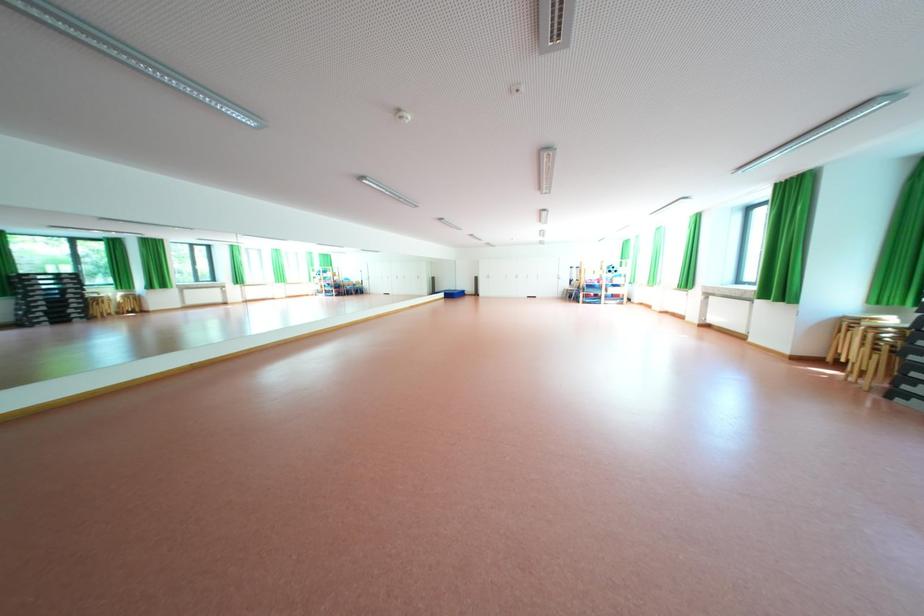
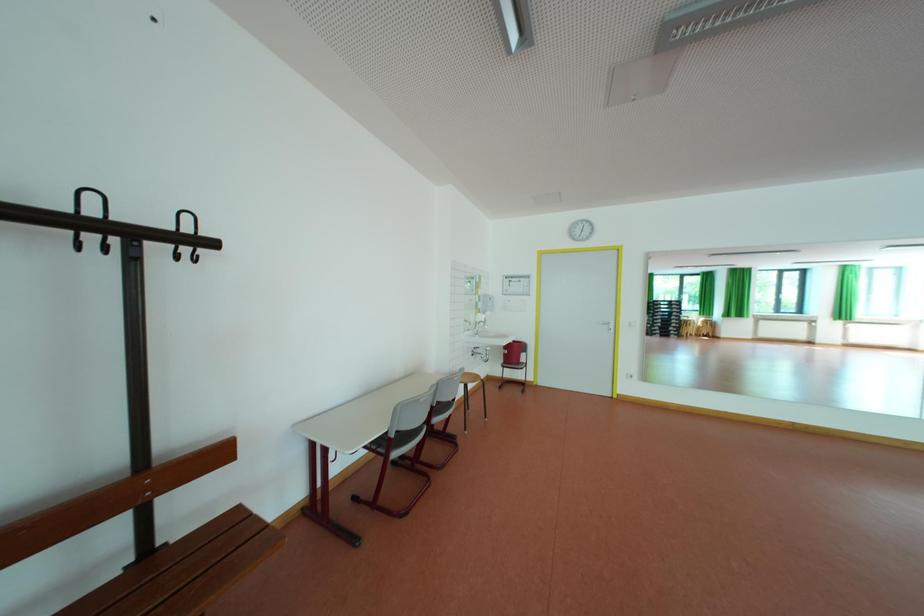
Question: How did the camera likely rotate?

Choices:
 (A) Left
 (B) Right
 (C) Up
 (D) Down

Answer: (A)